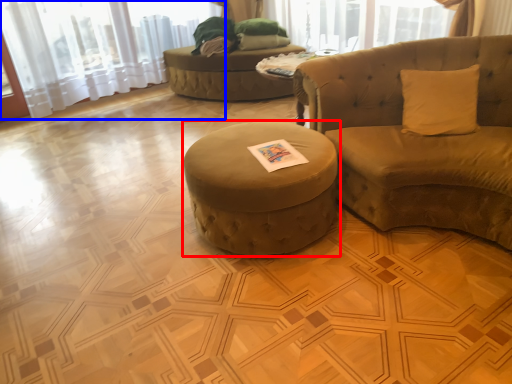
Question: Among these objects, which one is farthest to the camera, table (highlighted by a red box) or curtain (highlighted by a blue box)?

Choices:
 (A) table
 (B) curtain

Answer: (B)